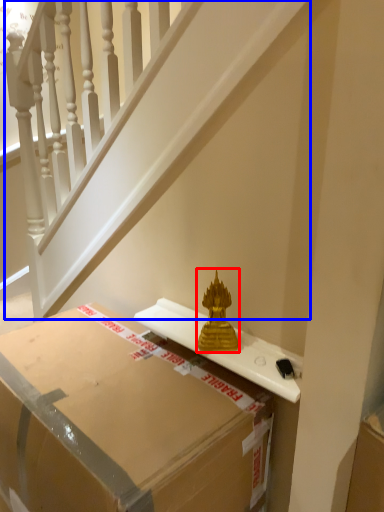
Question: Which object is closer to the camera taking this photo, sculpture (highlighted by a red box) or stairwell (highlighted by a blue box)?

Choices:
 (A) sculpture
 (B) stairwell

Answer: (B)